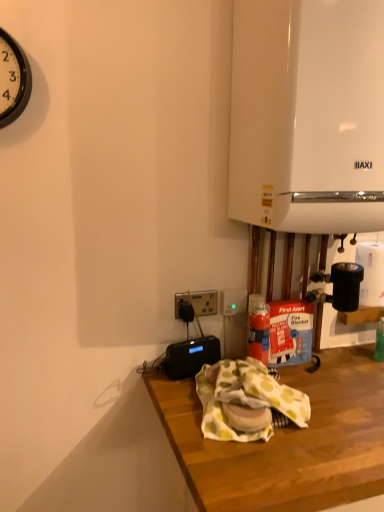
The width and height of the screenshot is (384, 512). What do you see at coordinates (307, 115) in the screenshot? I see `white glossy boiler at upper right, which appears as the 1th appliance when viewed from the right` at bounding box center [307, 115].

What do you see at coordinates (233, 301) in the screenshot? I see `black plastic socket at center` at bounding box center [233, 301].

Find the location of a particular element. The height and width of the screenshot is (512, 384). white glossy boiler at upper right, which appears as the 1th appliance when viewed from the right is located at coordinates (307, 115).

Is black plastic clock at upper left bigger than black plastic power outlet at center?

Yes, black plastic clock at upper left is bigger than black plastic power outlet at center.

Which is closer to the camera, (3, 80) or (205, 300)?

The point (3, 80) is in front.

From the picture: Is black plastic clock at upper left not near black plastic power outlet at center?

black plastic clock at upper left is actually quite close to black plastic power outlet at center.

Consider the image. Which is more to the right, white matte paper towel at right or black plastic socket at center?

From the viewer's perspective, white matte paper towel at right appears more on the right side.

Which of these two, white matte paper towel at right or black plastic socket at center, is wider?

Wider between the two is white matte paper towel at right.

Would you say white matte paper towel at right is inside or outside black plastic socket at center?

white matte paper towel at right is located beyond the bounds of black plastic socket at center.

Are white matte paper towel at right and black plastic socket at center making contact?

No, white matte paper towel at right is not touching black plastic socket at center.

In the scene shown: Which object is more forward, white glossy boiler at upper right, arranged as the first appliance when viewed from the top, or black plastic radio at lower center, the 1th appliance from the bottom?

white glossy boiler at upper right, arranged as the first appliance when viewed from the top, is closer to the camera.

Considering the sizes of objects white glossy boiler at upper right, arranged as the first appliance when viewed from the top, and black plastic radio at lower center, which appears as the first appliance when viewed from the left, in the image provided, who is wider, white glossy boiler at upper right, arranged as the first appliance when viewed from the top, or black plastic radio at lower center, which appears as the first appliance when viewed from the left,?

white glossy boiler at upper right, arranged as the first appliance when viewed from the top, is wider.

Consider the image. Could you measure the distance between white glossy boiler at upper right, marked as the 2th appliance in a left-to-right arrangement, and black plastic radio at lower center, which is the 2th appliance in right-to-left order?

white glossy boiler at upper right, marked as the 2th appliance in a left-to-right arrangement, is 28.01 inches from black plastic radio at lower center, which is the 2th appliance in right-to-left order.

Is white glossy boiler at upper right, which appears as the 1th appliance when viewed from the right, facing towards black plastic radio at lower center, the 1th appliance from the bottom?

No, white glossy boiler at upper right, which appears as the 1th appliance when viewed from the right, is not turned towards black plastic radio at lower center, the 1th appliance from the bottom.

Considering the sizes of objects black plastic socket at center and black plastic power outlet at center in the image provided, who is taller, black plastic socket at center or black plastic power outlet at center?

black plastic socket at center is taller.

Is black plastic socket at center bigger than black plastic power outlet at center?

Correct, black plastic socket at center is larger in size than black plastic power outlet at center.

Does black plastic socket at center contain black plastic power outlet at center?

No, black plastic power outlet at center is located outside of black plastic socket at center.

At what (x,y) coordinates should I click in order to perform the action: click on power outlet that is on the left side of black plastic socket at center. Please return your answer as a coordinate pair (x, y). Looking at the image, I should click on (198, 302).

Is black plastic socket at center a part of black plastic power outlet at center?

No, black plastic power outlet at center does not contain black plastic socket at center.

Would you say black plastic power outlet at center is a long distance from black plastic socket at center?

No.

Is black plastic power outlet at center situated inside white matte paper towel at right or outside?

black plastic power outlet at center is located beyond the bounds of white matte paper towel at right.

From the picture: Who is more distant, black plastic power outlet at center or white matte paper towel at right?

Positioned behind is white matte paper towel at right.

Are black plastic power outlet at center and white matte paper towel at right located far from each other?

black plastic power outlet at center is near white matte paper towel at right, not far away.

Is black plastic power outlet at center thinner than white matte paper towel at right?

Correct, the width of black plastic power outlet at center is less than that of white matte paper towel at right.

Which is behind, wooden desk at lower center or white glossy boiler at upper right, marked as the 2th appliance in a left-to-right arrangement?

white glossy boiler at upper right, marked as the 2th appliance in a left-to-right arrangement, is further from the camera.

How much distance is there between wooden desk at lower center and white glossy boiler at upper right, which is the 2th appliance from bottom to top?

The distance of wooden desk at lower center from white glossy boiler at upper right, which is the 2th appliance from bottom to top, is 27.23 inches.

Could you tell me if wooden desk at lower center is turned towards white glossy boiler at upper right, marked as the 2th appliance in a left-to-right arrangement?

No, wooden desk at lower center does not turn towards white glossy boiler at upper right, marked as the 2th appliance in a left-to-right arrangement.

From a real-world perspective, between wooden desk at lower center and white glossy boiler at upper right, marked as the 2th appliance in a left-to-right arrangement, who is vertically lower?

In real-world perspective, wooden desk at lower center is lower.

At what (x,y) coordinates should I click in order to perform the action: click on clock above the black plastic power outlet at center (from the image's perspective). Please return your answer as a coordinate pair (x, y). This screenshot has width=384, height=512. Looking at the image, I should click on (13, 79).

This screenshot has width=384, height=512. Find the location of `electric outlet to the left of white matte paper towel at right`. electric outlet to the left of white matte paper towel at right is located at coordinates (233, 301).

Which object lies further to the anchor point black plastic socket at center, wooden desk at lower center or white matte paper towel at right?

Based on the image, wooden desk at lower center appears to be further to black plastic socket at center.

Estimate the real-world distances between objects in this image. Which object is further from black plastic radio at lower center, arranged as the 2th appliance when viewed from the top, black plastic power outlet at center or wooden desk at lower center?

wooden desk at lower center is positioned further to the anchor black plastic radio at lower center, arranged as the 2th appliance when viewed from the top.

Which object lies nearer to the anchor point white glossy boiler at upper right, which is the 2th appliance from bottom to top, black plastic radio at lower center, arranged as the 2th appliance when viewed from the top, or wooden desk at lower center?

Among the two, wooden desk at lower center is located nearer to white glossy boiler at upper right, which is the 2th appliance from bottom to top.

Considering their positions, is black plastic clock at upper left positioned further to wooden desk at lower center than black plastic socket at center?

black plastic clock at upper left is further to wooden desk at lower center.

Considering their positions, is black plastic socket at center positioned closer to black plastic power outlet at center than black plastic radio at lower center, the 1th appliance from the bottom?

black plastic socket at center.

Estimate the real-world distances between objects in this image. Which object is closer to black plastic power outlet at center, wooden desk at lower center or white glossy boiler at upper right, arranged as the first appliance when viewed from the top?

wooden desk at lower center lies closer to black plastic power outlet at center than the other object.

Which object lies further to the anchor point wooden desk at lower center, black plastic power outlet at center or black plastic radio at lower center, which is the 2th appliance in right-to-left order?

The object further to wooden desk at lower center is black plastic power outlet at center.

Consider the image. Which object lies further to the anchor point black plastic socket at center, white matte paper towel at right or black plastic radio at lower center, which is the 2th appliance in right-to-left order?

white matte paper towel at right lies further to black plastic socket at center than the other object.

Find the location of a particular element. power outlet located between black plastic radio at lower center, the 1th appliance from the bottom, and white matte paper towel at right in the left-right direction is located at coordinates (198, 302).

Identify the location of power outlet between white glossy boiler at upper right, arranged as the first appliance when viewed from the top, and black plastic radio at lower center, which appears as the first appliance when viewed from the left, in the vertical direction. This screenshot has width=384, height=512. (198, 302).

Where is `paper towel between white glossy boiler at upper right, marked as the 2th appliance in a left-to-right arrangement, and black plastic radio at lower center, which is the 2th appliance in right-to-left order, in the up-down direction`? The height and width of the screenshot is (512, 384). paper towel between white glossy boiler at upper right, marked as the 2th appliance in a left-to-right arrangement, and black plastic radio at lower center, which is the 2th appliance in right-to-left order, in the up-down direction is located at coordinates (371, 273).

Where is `electric outlet located between black plastic power outlet at center and white matte paper towel at right in the left-right direction`? electric outlet located between black plastic power outlet at center and white matte paper towel at right in the left-right direction is located at coordinates (x=233, y=301).